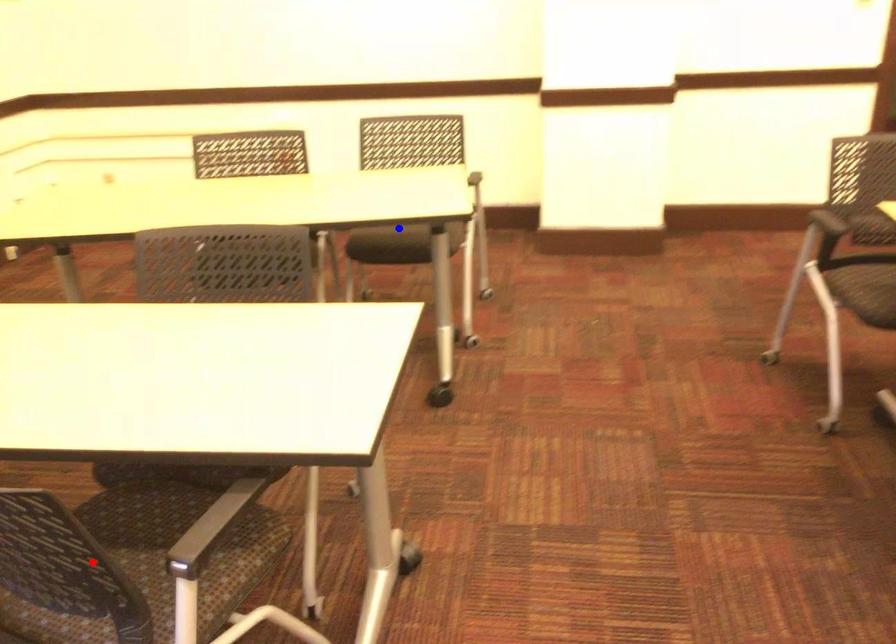
Question: In the image, two points are highlighted. Which point is nearer to the camera? Reply with the corresponding letter.

Choices:
 (A) blue point
 (B) red point

Answer: (B)